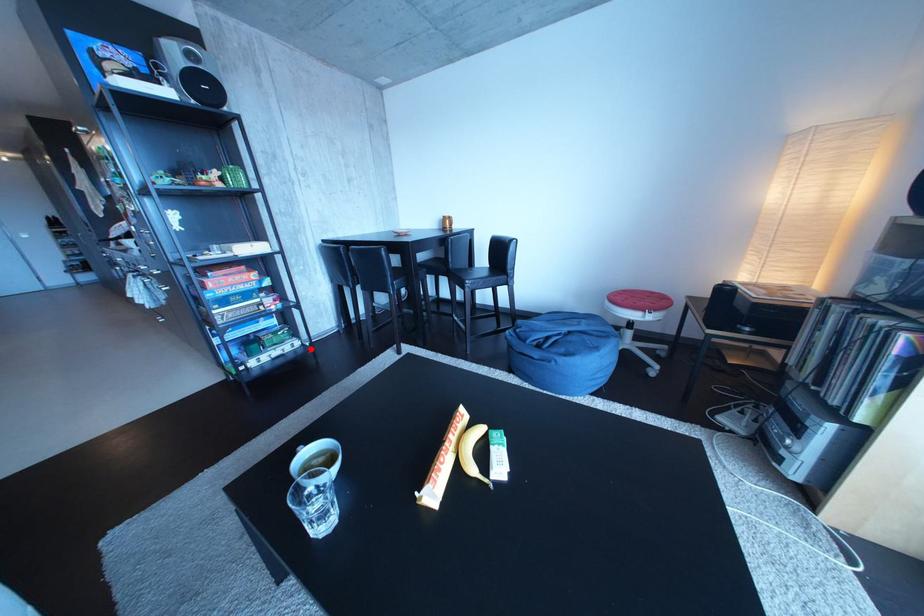
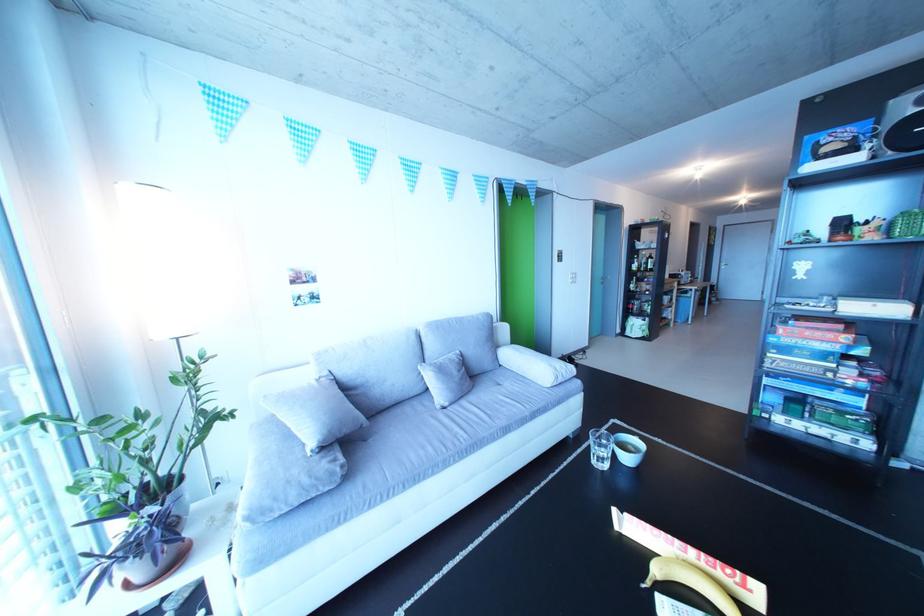
Question: I am providing you with two images of the same scene from different viewpoints. A red point is shown in image1. For the corresponding object point in image2, is it positioned nearer or farther from the camera?

Choices:
 (A) Nearer
 (B) Farther

Answer: (B)